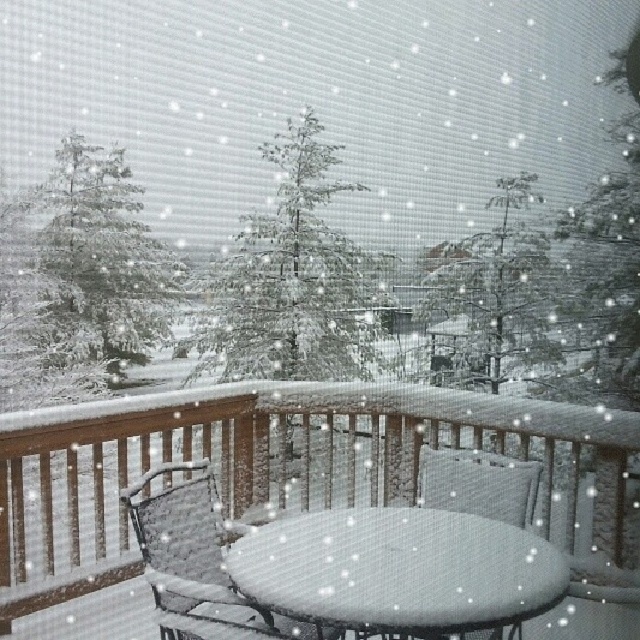
Question: Does white textured table at center appear on the left side of woven wicker chair at center?

Choices:
 (A) yes
 (B) no

Answer: (B)

Question: Can you confirm if wooden table at center is smaller than snow-covered pine tree at upper left?

Choices:
 (A) no
 (B) yes

Answer: (A)

Question: Estimate the real-world distances between objects in this image. Which object is farther from the snow-covered pine tree at center?

Choices:
 (A) wooden table at center
 (B) snow-covered pine tree at upper left

Answer: (B)

Question: Which of these objects is positioned closest to the green textured evergreen tree at center?

Choices:
 (A) woven wicker chair at center
 (B) snow-covered pine tree at center
 (C) snow-covered pine tree at upper left

Answer: (C)

Question: Where is wooden table at center located in relation to green textured evergreen tree at center in the image?

Choices:
 (A) above
 (B) below

Answer: (B)

Question: Among these points, which one is nearest to the camera?

Choices:
 (A) (424, 458)
 (B) (248, 237)
 (C) (67, 246)

Answer: (C)